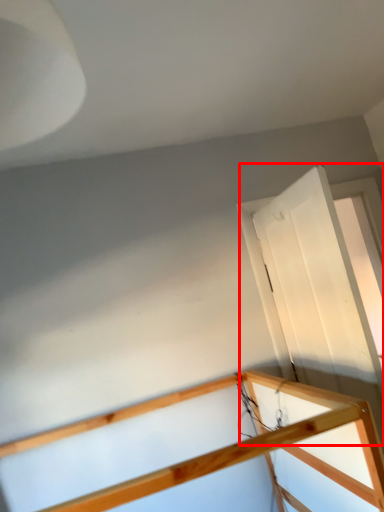
Question: In this image, where is glass door (annotated by the red box) located relative to rail?

Choices:
 (A) left
 (B) right

Answer: (B)